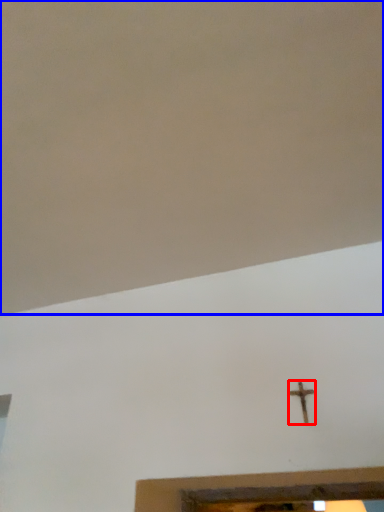
Question: Which point is further to the camera, nail (highlighted by a red box) or backdrop (highlighted by a blue box)?

Choices:
 (A) nail
 (B) backdrop

Answer: (A)